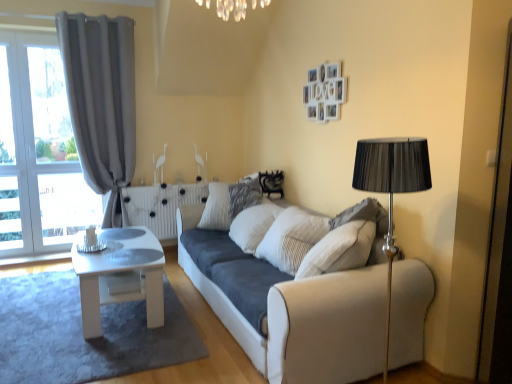
Locate an element on the screen. free space in front of white glossy table at center is located at coordinates (84, 348).